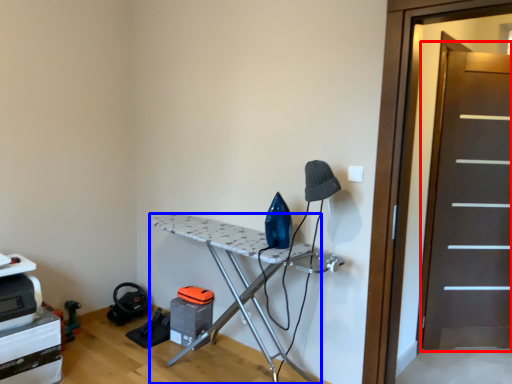
Question: Which of the following is the farthest to the observer, screen door (highlighted by a red box) or furniture (highlighted by a blue box)?

Choices:
 (A) screen door
 (B) furniture

Answer: (A)